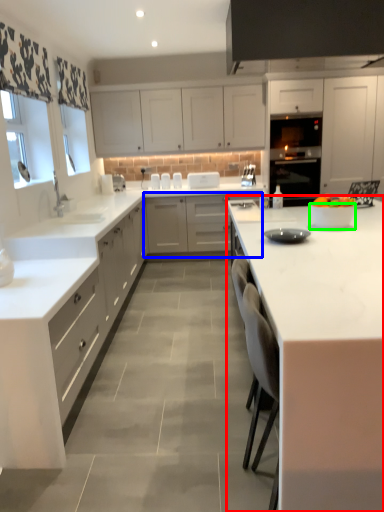
Question: Estimate the real-world distances between objects in this image. Which object is closer to countertop (highlighted by a red box), cabinetry (highlighted by a blue box) or bowl (highlighted by a green box)?

Choices:
 (A) cabinetry
 (B) bowl

Answer: (B)